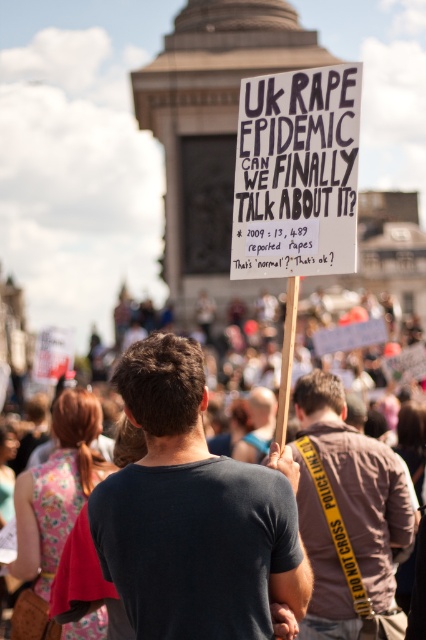
Question: Can you confirm if white paper sign at center is smaller than brown leather jacket at center?

Choices:
 (A) no
 (B) yes

Answer: (B)

Question: Can you confirm if dark gray t-shirt at center is positioned below white paper sign at center?

Choices:
 (A) yes
 (B) no

Answer: (A)

Question: Which of these objects is positioned closest to the brown leather jacket at center?

Choices:
 (A) dark gray t-shirt at center
 (B) white paper sign at center

Answer: (A)

Question: Estimate the real-world distances between objects in this image. Which object is farther from the brown leather jacket at center?

Choices:
 (A) white paper sign at center
 (B) dark gray t-shirt at center

Answer: (A)

Question: Does dark gray t-shirt at center appear on the right side of white paper sign at center?

Choices:
 (A) yes
 (B) no

Answer: (B)

Question: Which of the following is the closest to the observer?

Choices:
 (A) (359, 488)
 (B) (253, 250)
 (C) (305, 592)

Answer: (C)